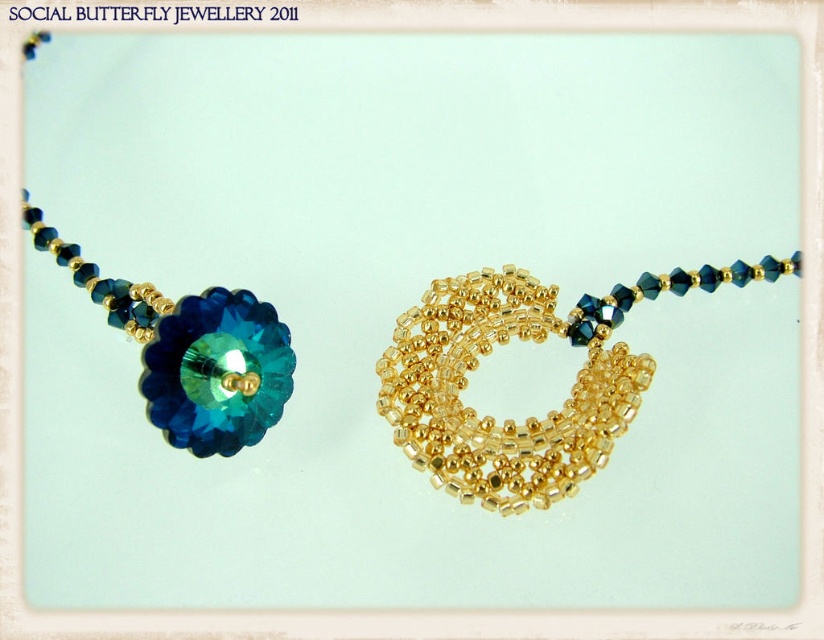
You are an appraiser examining the necklace. The pendant is at the top of the necklace. Where is the gold textured beads at center in relation to the pendant?

The gold textured beads at center are positioned below the pendant since their coordinates are at point (528,417), which places them lower on the necklace.

You are an appraiser examining the necklace. You need to determine the placement of the gold textured beads at center and the teal crystal flower at left. Which object is located to the right of the other?

The gold textured beads at center is positioned on the right side of teal crystal flower at left, so the gold textured beads at center is to the right of the teal crystal flower at left.

Looking at this image, you are a photographer trying to capture the necklace in focus. You know that your camera can focus on objects within 1.5 meters. Is the point at coordinates point (420, 356) within the camera focus range?

The distance between point (420, 356) and the camera is 1.37 meters, which is within the camera focus range of 1.5 meters. Therefore, the point at coordinates point (420, 356) is within the focus range.